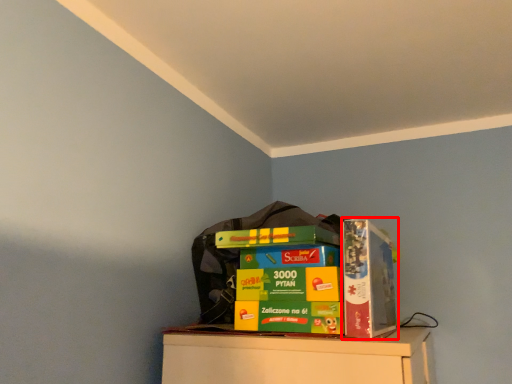
Question: From the image's perspective, what is the correct spatial relationship of paperback book (annotated by the red box) in relation to collection?

Choices:
 (A) above
 (B) below

Answer: (A)